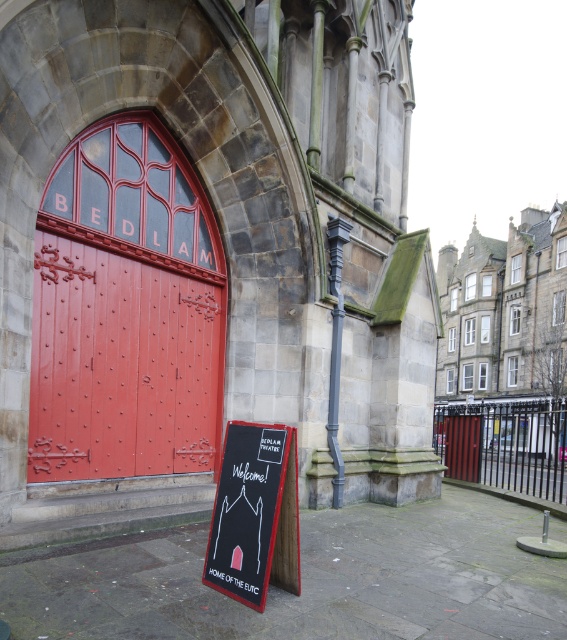
Question: Can you confirm if stone church at center is positioned to the right of dark gray stone church at center?

Choices:
 (A) yes
 (B) no

Answer: (B)

Question: Which point appears farthest from the camera in this image?

Choices:
 (A) (468, 438)
 (B) (564, 209)
 (C) (282, 438)

Answer: (B)

Question: Is smooth red wooden door at center wider than wooden door at center?

Choices:
 (A) no
 (B) yes

Answer: (B)

Question: Among these objects, which one is farthest from the camera?

Choices:
 (A) smooth red wooden door at center
 (B) black cardboard sign at center

Answer: (A)

Question: Is smooth red wooden door at center in front of black cardboard sign at center?

Choices:
 (A) no
 (B) yes

Answer: (A)

Question: Based on their relative distances, which object is nearer to the smooth red wooden door at center?

Choices:
 (A) wooden door at center
 (B) black cardboard sign at center
 (C) stone church at center

Answer: (C)